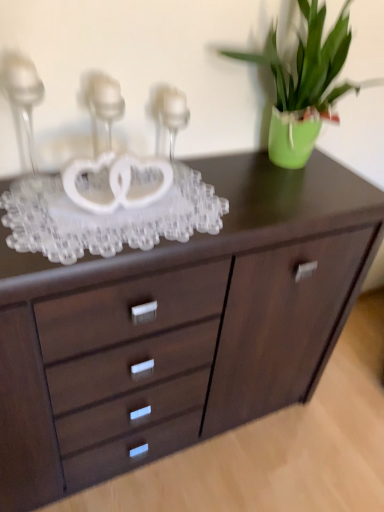
Where is `vacant area that is in front of clear glass candle holder at upper left, acting as the 2th candle holder starting from the right`? vacant area that is in front of clear glass candle holder at upper left, acting as the 2th candle holder starting from the right is located at coordinates (95, 211).